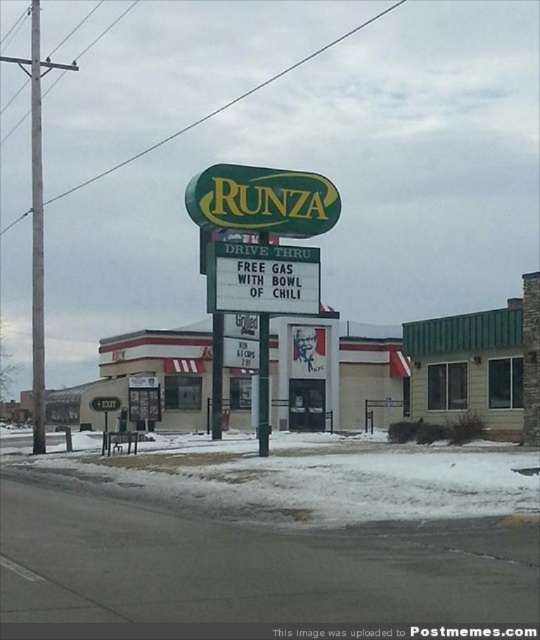
You are a customer looking at the Runza restaurant from the street. You see both the white powdery snow at lower center and the white paper sign at center. Which of these two items is larger in size?

The white powdery snow at lower center is bigger than the white paper sign at center.

You are standing in front of the Runza restaurant and notice a specific location marked by coordinates. Based on the image description, what is the object located at point (329,477)?

The point (329,477) marks white powdery snow at lower center.